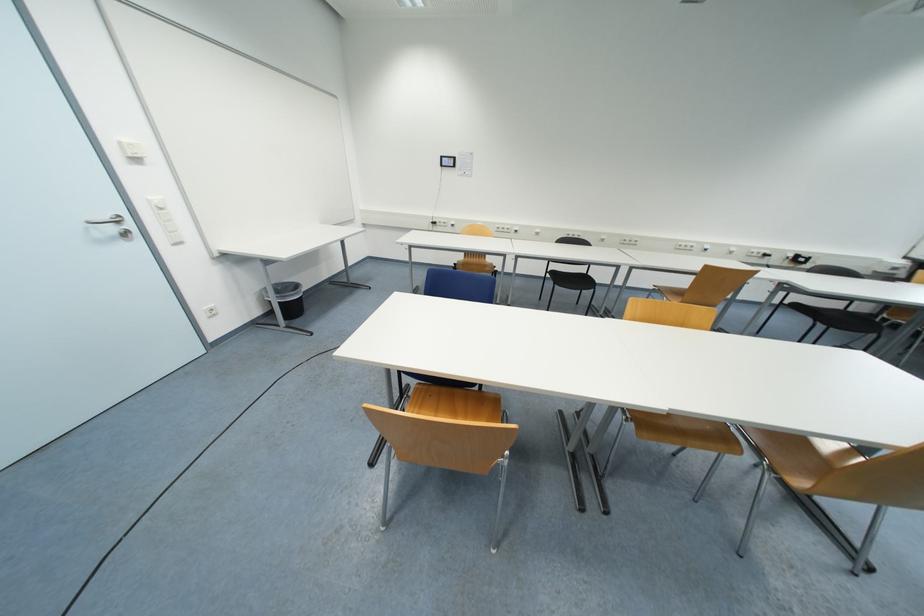
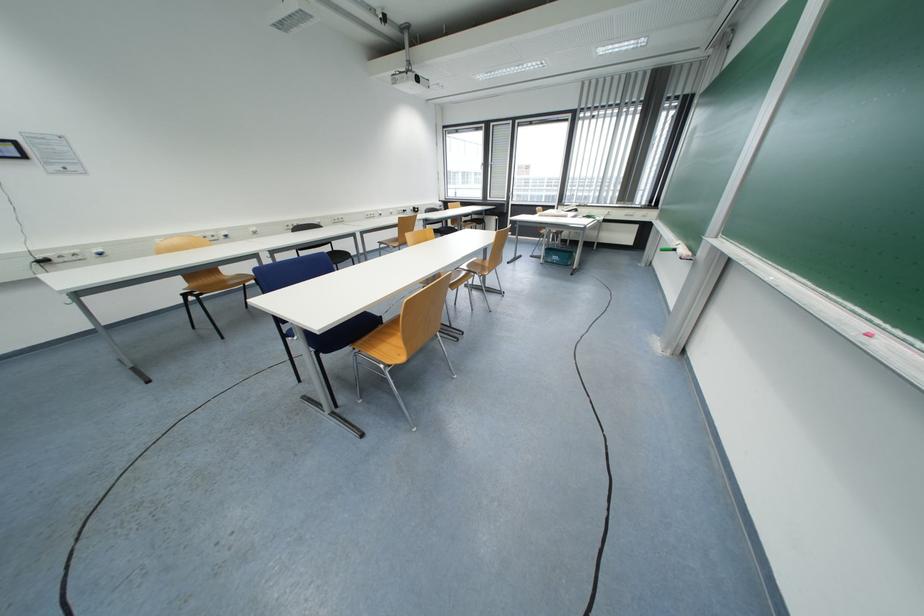
The point at (586, 272) is marked in the first image. Where is the corresponding point in the second image?

(332, 251)